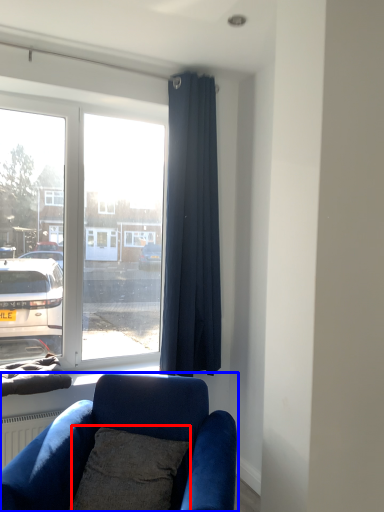
Question: Which object appears closest to the camera in this image, pillow (highlighted by a red box) or studio couch (highlighted by a blue box)?

Choices:
 (A) pillow
 (B) studio couch

Answer: (B)